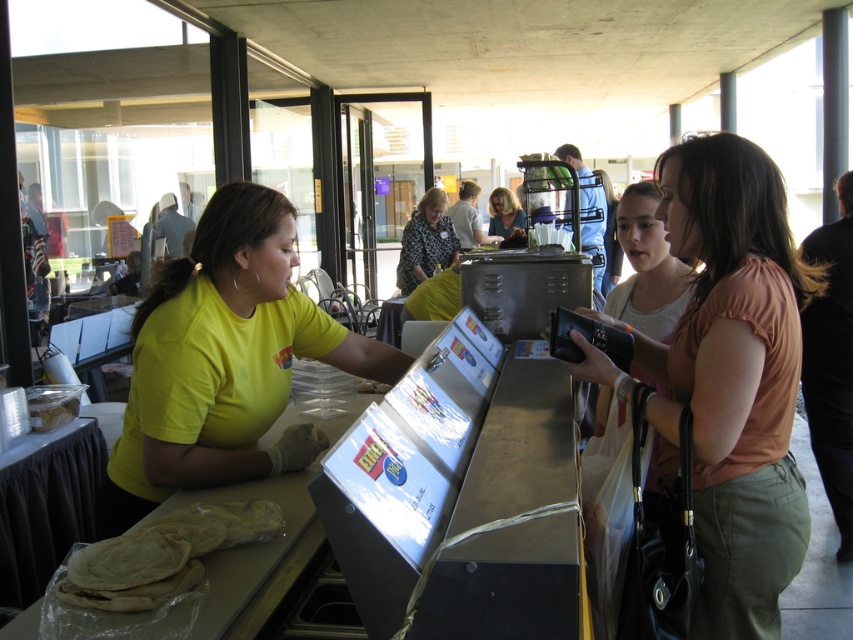
Who is higher up, matte peach blouse at center or patterned fabric blouse at center?

patterned fabric blouse at center is higher up.

Who is lower down, matte peach blouse at center or patterned fabric blouse at center?

matte peach blouse at center is lower down.

You are a GUI agent. You are given a task and a screenshot of the screen. Output one action in this format:
    pyautogui.click(x=<x>, y=<y>)
    Task: Click on the matte peach blouse at center
    This screenshot has height=640, width=853.
    Given the screenshot: What is the action you would take?
    pyautogui.click(x=732, y=376)

Which of these two, patterned fabric blouse at center or matte black camera at center, stands taller?

patterned fabric blouse at center is taller.

Can you confirm if patterned fabric blouse at center is wider than matte black camera at center?

No, patterned fabric blouse at center is not wider than matte black camera at center.

Locate an element on the screen. This screenshot has width=853, height=640. patterned fabric blouse at center is located at coordinates (426, 241).

Who is positioned more to the right, matte peach blouse at center or matte black camera at center?

Positioned to the right is matte peach blouse at center.

Where is `matte peach blouse at center`? This screenshot has width=853, height=640. matte peach blouse at center is located at coordinates (732, 376).

What do you see at coordinates (732, 376) in the screenshot? I see `matte peach blouse at center` at bounding box center [732, 376].

Locate an element on the screen. The height and width of the screenshot is (640, 853). matte peach blouse at center is located at coordinates (732, 376).